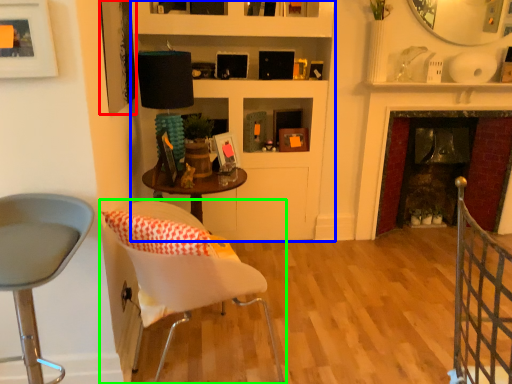
Question: Based on their relative distances, which object is nearer to picture frame (highlighted by a red box)? Choose from bookshelf (highlighted by a blue box) and chair (highlighted by a green box).

Choices:
 (A) bookshelf
 (B) chair

Answer: (B)